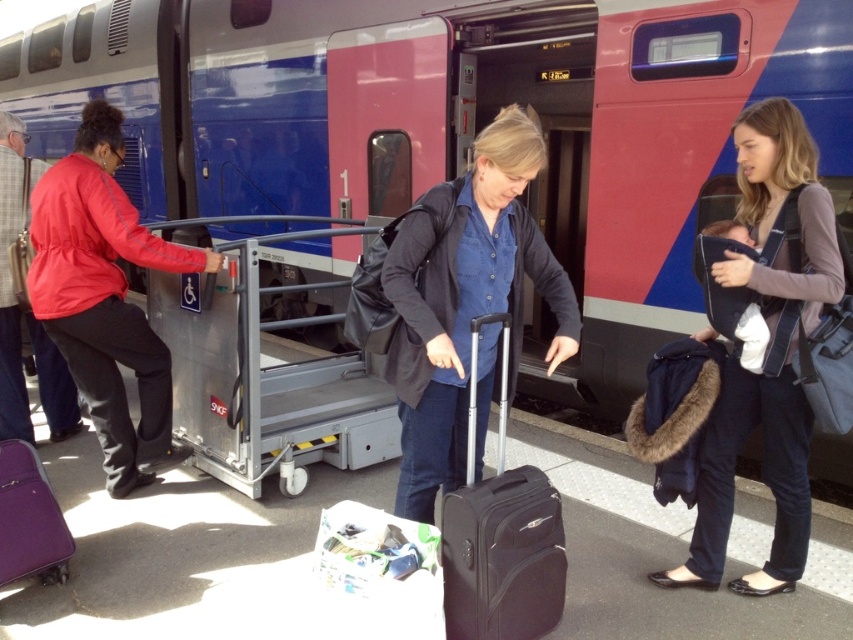
You are a GUI agent. You are given a task and a screenshot of the screen. Output one action in this format:
    pyautogui.click(x=<x>, y=<y>)
    Task: Click on the dark blue jeans at center
    
    Given the screenshot: What is the action you would take?
    pyautogui.click(x=770, y=340)

Is dark blue jeans at center in front of black hardshell suitcase at center?

No, dark blue jeans at center is further to the viewer.

Identify the location of dark blue jeans at center. (770, 340).

The image size is (853, 640). Find the location of `dark blue jeans at center`. dark blue jeans at center is located at coordinates (770, 340).

Does denim shirt at center appear over dark blue jeans at center?

Correct, denim shirt at center is located above dark blue jeans at center.

Does denim shirt at center have a lesser width compared to dark blue jeans at center?

No.

Image resolution: width=853 pixels, height=640 pixels. What do you see at coordinates (465, 300) in the screenshot?
I see `denim shirt at center` at bounding box center [465, 300].

You are a GUI agent. You are given a task and a screenshot of the screen. Output one action in this format:
    pyautogui.click(x=<x>, y=<y>)
    Task: Click on the denim shirt at center
    The height and width of the screenshot is (640, 853).
    Given the screenshot: What is the action you would take?
    pyautogui.click(x=465, y=300)

Which is more to the right, denim shirt at center or matte purple suitcase at lower left?

denim shirt at center is more to the right.

Does denim shirt at center have a greater width compared to matte purple suitcase at lower left?

Yes.

Does point (451, 298) come behind point (32, 568)?

No, (451, 298) is in front of (32, 568).

You are a GUI agent. You are given a task and a screenshot of the screen. Output one action in this format:
    pyautogui.click(x=<x>, y=<y>)
    Task: Click on the denim shirt at center
    
    Given the screenshot: What is the action you would take?
    (465, 300)